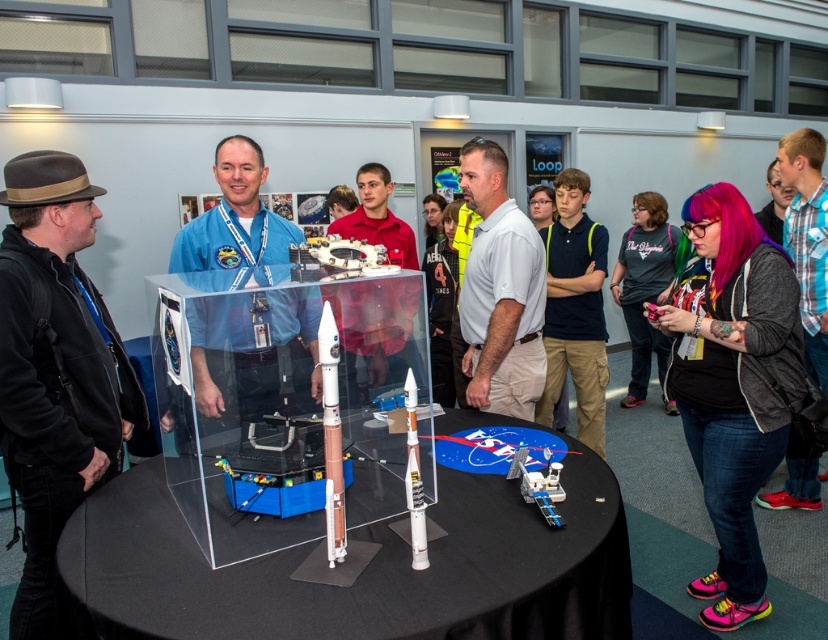
Question: Which object is the closest to the blue plaid shirt at right?

Choices:
 (A) dark blue shirt at center
 (B) matte orange rocket at center
 (C) clear acrylic table at center

Answer: (A)

Question: Which point appears farthest from the camera in this image?

Choices:
 (A) (320, 339)
 (B) (203, 401)
 (C) (494, 268)
 (D) (599, 378)

Answer: (D)

Question: Is black plastic table at center further to camera compared to shiny metallic satellite at center?

Choices:
 (A) yes
 (B) no

Answer: (B)

Question: Is matte orange rocket at center smaller than pink hair at upper right?

Choices:
 (A) yes
 (B) no

Answer: (A)

Question: Which of the following is the farthest from the observer?

Choices:
 (A) dark blue shirt at center
 (B) black fleece jacket at left
 (C) clear acrylic table at center

Answer: (A)

Question: Observing the image, what is the correct spatial positioning of black fleece jacket at left in reference to blue plaid shirt at right?

Choices:
 (A) right
 (B) left

Answer: (B)